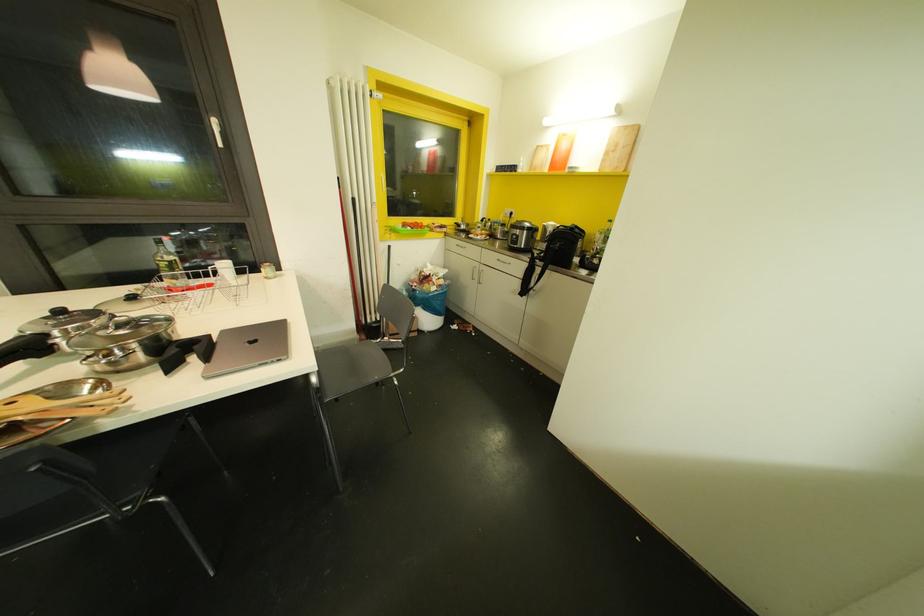
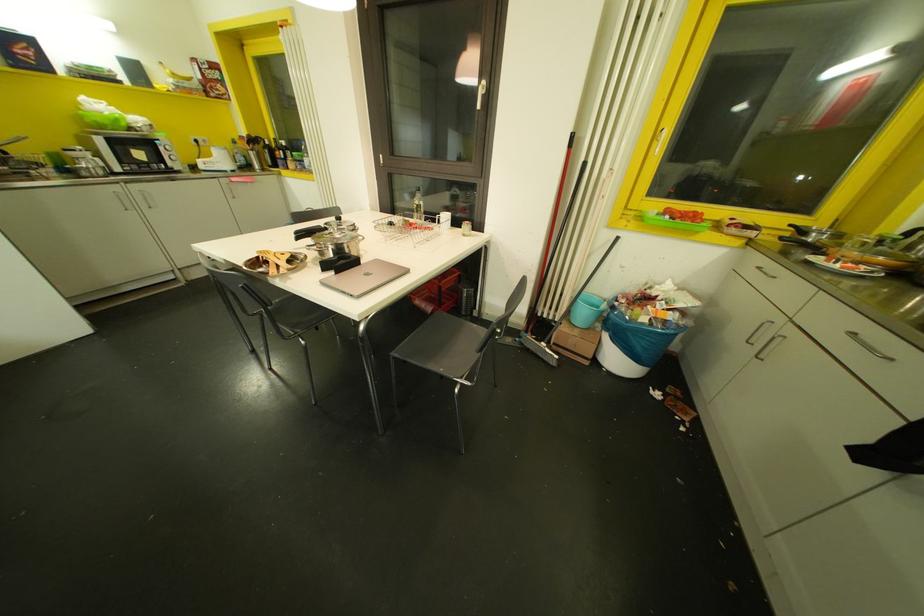
In the second image, find the point that corresponds to point 213,122 in the first image.

(481, 81)